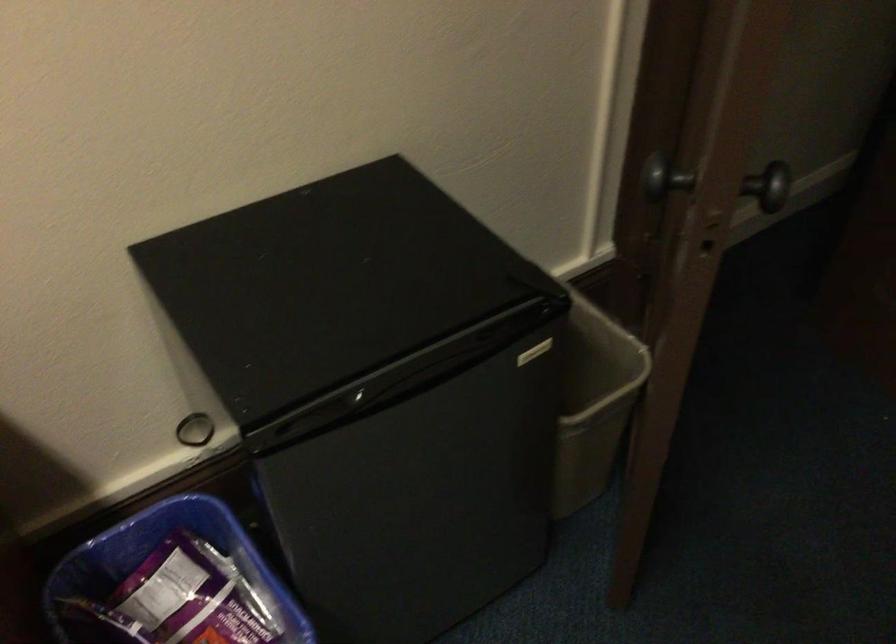
Find where to pull the refrigerator door handle. Please return your answer as a coordinate pair (x, y).

(365, 399)